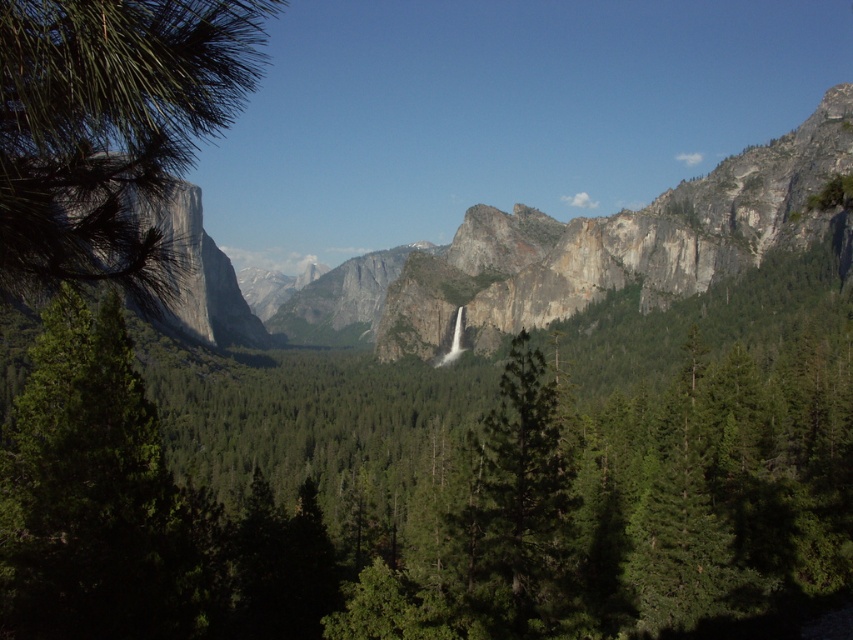
Question: Can you confirm if green matte pine forest at center is thinner than green needle-like at left?

Choices:
 (A) no
 (B) yes

Answer: (A)

Question: Which is farther from the green matte pine forest at center?

Choices:
 (A) green needle-like at left
 (B) green matte tree at center

Answer: (A)

Question: Where is green matte pine forest at center located in relation to green matte tree at center in the image?

Choices:
 (A) left
 (B) right

Answer: (A)

Question: Among these points, which one is farthest from the camera?

Choices:
 (A) (483, 444)
 (B) (608, 563)

Answer: (A)

Question: Can you confirm if green matte pine forest at center is smaller than green matte tree at center?

Choices:
 (A) yes
 (B) no

Answer: (B)

Question: Which point is farther to the camera?

Choices:
 (A) (461, 429)
 (B) (506, 429)

Answer: (A)